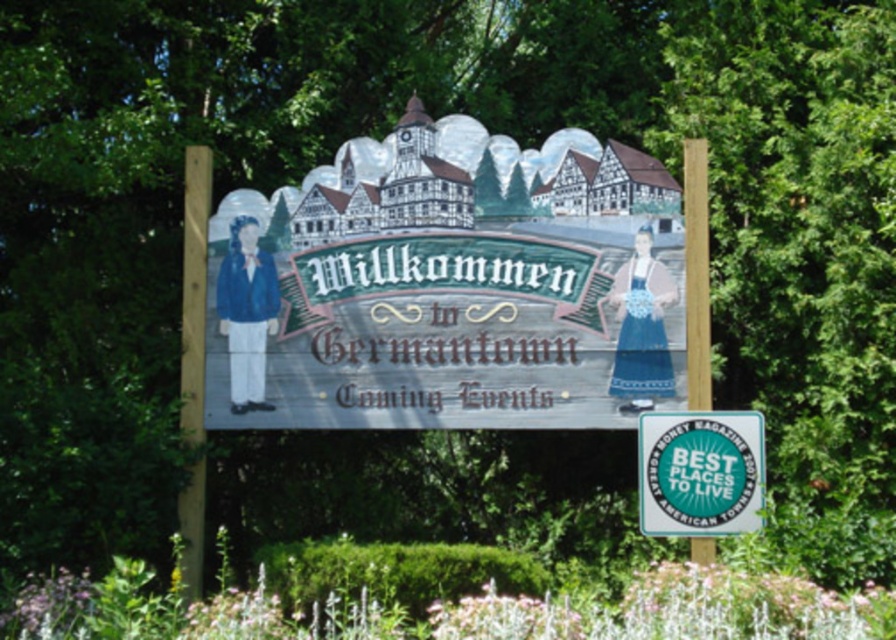
From the picture: You are standing in front of the Germantown welcome sign. There are two points marked on the signboard. The first point is at coordinates point (300, 337) and the second is at point (757, 467). If you want to touch both points starting from the one closer to you, which point should you touch first?

You should touch point (300, 337) first because it is closer to you than point (757, 467).

You are standing in front of the Germantown signboard and want to read both the wooden signboard at center and the green glossy sign at center. Which one should you look to your left to read?

The wooden signboard at center is to the left of the green glossy sign at center, so you should look to your left to read the wooden signboard at center.